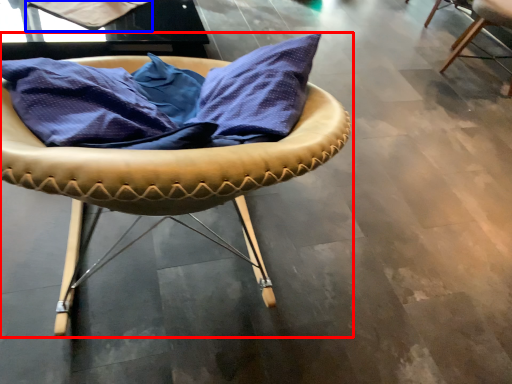
Question: Which point is further to the camera, chair (highlighted by a red box) or fabric (highlighted by a blue box)?

Choices:
 (A) chair
 (B) fabric

Answer: (B)